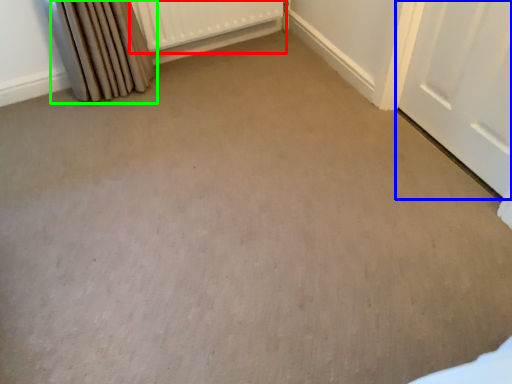
Question: Considering the real-world distances, which object is closest to radiator (highlighted by a red box)? door (highlighted by a blue box) or curtain (highlighted by a green box).

Choices:
 (A) door
 (B) curtain

Answer: (B)